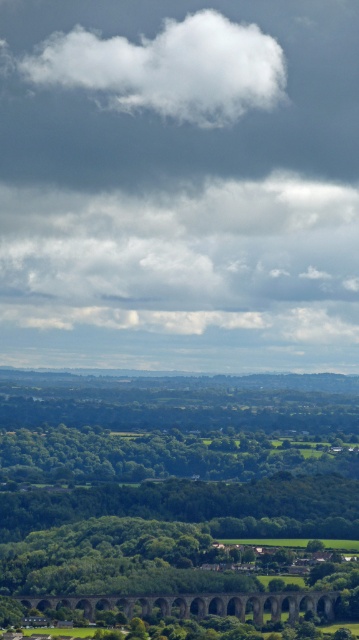
You are standing at the point marked as point (165, 484) in the image. What type of terrain are you standing on?

You are standing on a green grassy field at lower center.

You are a bird soaring in the sky above the countryside. You see the white fluffy cloud at upper center and the brown stone viaduct at lower center. Which object is higher from the ground?

The white fluffy cloud at upper center is higher from the ground compared to the brown stone viaduct at lower center because it has a greater height.